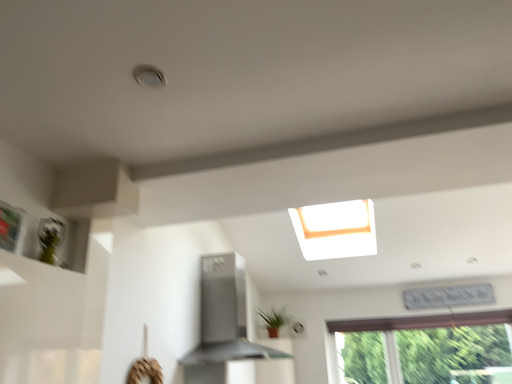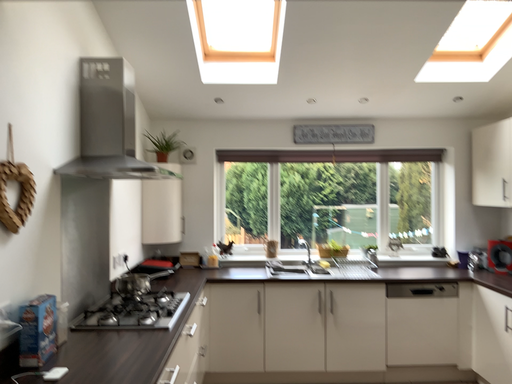
Question: Which way did the camera rotate in the video?

Choices:
 (A) rotated downward
 (B) rotated upward

Answer: (A)